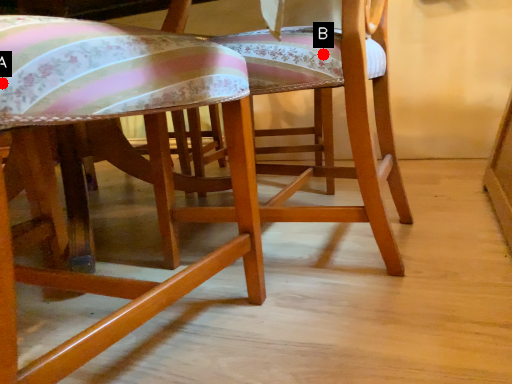
Question: Two points are circled on the image, labeled by A and B beside each circle. Which point is closer to the camera?

Choices:
 (A) A is closer
 (B) B is closer

Answer: (A)